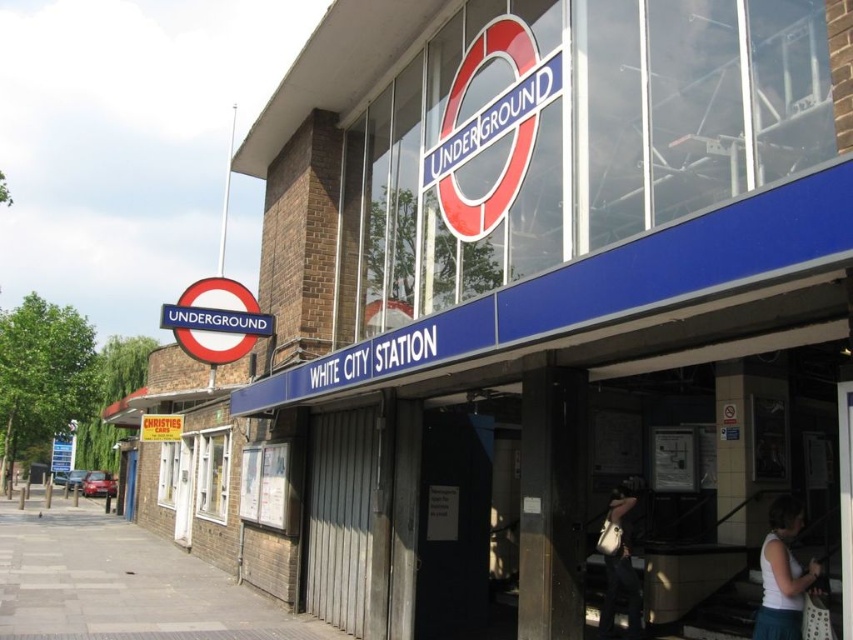
You are a commuter carrying both the white fabric bag at lower right and the leather handbag at lower right. You need to place them side by side on the bench next to the closed metal security gate. Which bag will take up less space horizontally?

The white fabric bag at lower right has a lesser width compared to the leather handbag at lower right, so it will take up less horizontal space.

You are standing at the entrance of White City Underground Station and need to locate the blue metallic signboard at center and the gray concrete pavement at lower left. Which object is taller?

The blue metallic signboard at center is much taller than the gray concrete pavement at lower left.

You are a delivery driver trying to park your van near the entrance of White City Underground Station. You see the blue metallic signboard at center and the gray concrete pavement at lower left. Which area has enough space to park your van?

The gray concrete pavement at lower left is larger than the blue metallic signboard at center, so the gray concrete pavement at lower left has enough space to park the van.